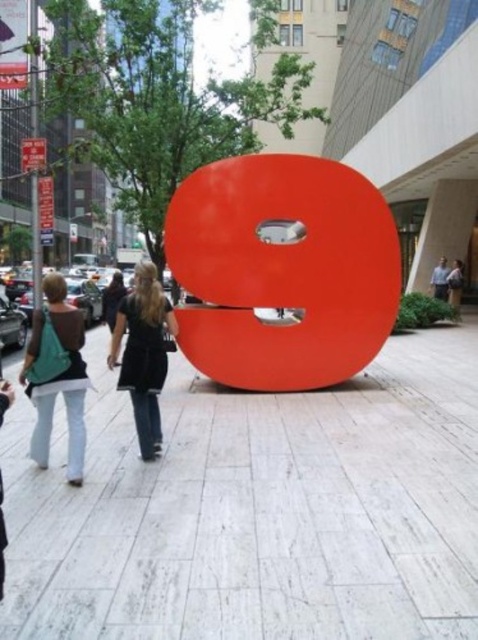
Question: Does black matte dress at center appear on the right side of matte teal bag at left?

Choices:
 (A) no
 (B) yes

Answer: (B)

Question: Which point is farther to the camera?

Choices:
 (A) matte orange sculpture at center
 (B) matte teal bag at left

Answer: (A)

Question: Which point is closer to the camera taking this photo?

Choices:
 (A) (338, 307)
 (B) (75, 396)
 (C) (154, 426)

Answer: (B)

Question: Is white stone pavement at center below black matte dress at center?

Choices:
 (A) no
 (B) yes

Answer: (B)

Question: Which object is closer to the camera taking this photo?

Choices:
 (A) matte teal bag at left
 (B) white stone pavement at center
 (C) black matte dress at center
 (D) matte orange sculpture at center

Answer: (B)

Question: Is matte orange sculpture at center to the right of matte teal bag at left from the viewer's perspective?

Choices:
 (A) yes
 (B) no

Answer: (A)